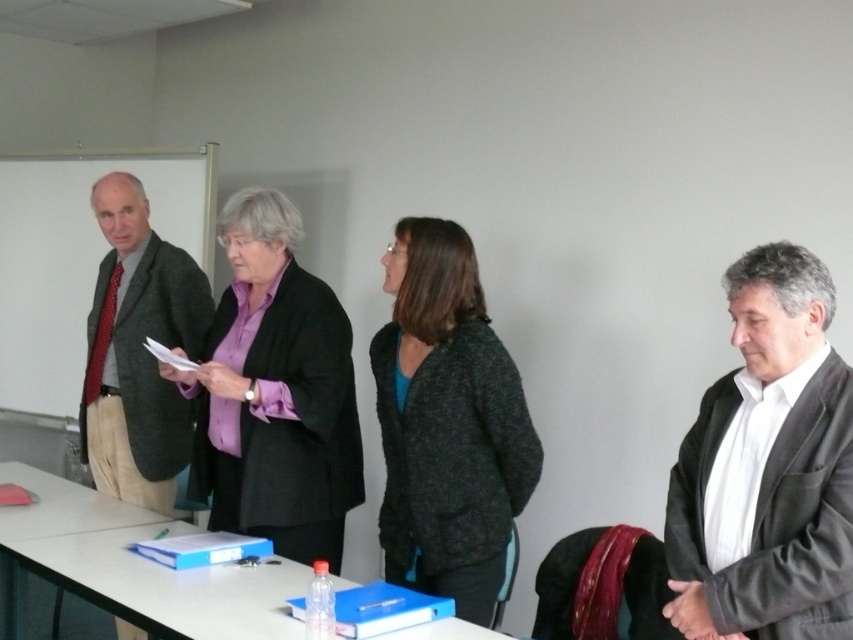
You are a photographer positioned at the camera. You want to take a photo that includes both the point at (744, 289) and the point at (136, 445). Which point should you focus on to ensure both are in sharp focus?

You should focus on the point at (136, 445) because it is farther from the camera than the point at (744, 289). By focusing on the farther point, the closer point will also be within the depth of field, ensuring both are in sharp focus.

You are organizing a photo shoot and need to arrange two people based on their height. You have the dark gray suit at right and the purple matte shirt at center. Which person should stand in front to ensure both are visible in the photo?

The dark gray suit at right should stand in front of the purple matte shirt at center because the dark gray suit at right is shorter than the purple matte shirt at center, allowing the taller individual to be partially visible behind.